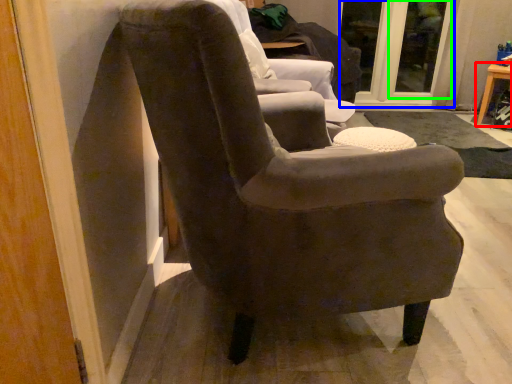
Question: Estimate the real-world distances between objects in this image. Which object is farther from table (highlighted by a red box), glass door (highlighted by a blue box) or glass door (highlighted by a green box)?

Choices:
 (A) glass door
 (B) glass door

Answer: (A)